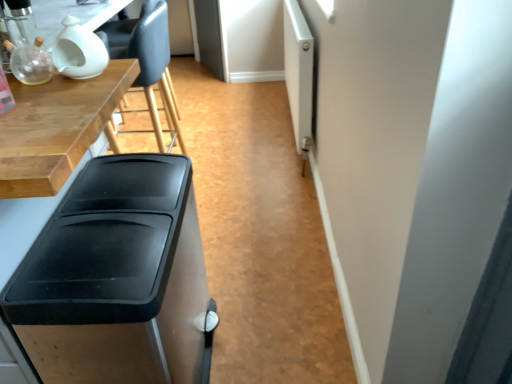
At what (x,y) coordinates should I click in order to perform the action: click on free spot above black plastic waste container at lower left (from a real-world perspective). Please return your answer as a coordinate pair (x, y). The image size is (512, 384). Looking at the image, I should click on (102, 209).